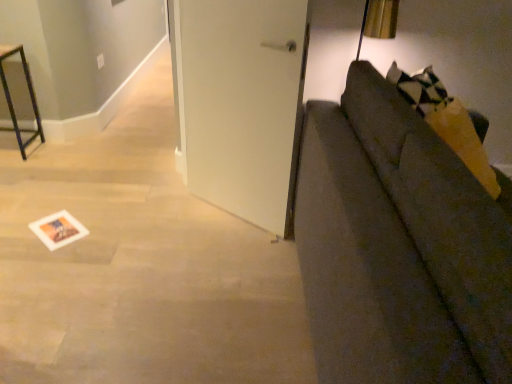
Image resolution: width=512 pixels, height=384 pixels. In order to click on white matte door at center in this screenshot , I will do coord(241,104).

The width and height of the screenshot is (512, 384). I want to click on metal frame at left, so click(x=12, y=102).

From a real-world perspective, who is located higher, white paper postcard at lower left or textured gray couch at right?

textured gray couch at right.

Consider the image. Between white paper postcard at lower left and textured gray couch at right, which one appears on the left side from the viewer's perspective?

white paper postcard at lower left is more to the left.

Choose the correct answer: Is white paper postcard at lower left inside textured gray couch at right or outside it?

The correct answer is: outside.

From a real-world perspective, which is physically above, white paper postcard at lower left or metal frame at left?

metal frame at left is physically above.

From the image's perspective, between white paper postcard at lower left and metal frame at left, who is located below?

From the image's view, white paper postcard at lower left is below.

Which object is further away from the camera taking this photo, white paper postcard at lower left or metal frame at left?

Positioned behind is metal frame at left.

Is white paper postcard at lower left facing away from metal frame at left?

No.

From their relative heights in the image, would you say metal frame at left is taller or shorter than white paper postcard at lower left?

metal frame at left is taller than white paper postcard at lower left.

Between point (6, 101) and point (71, 228), which one is positioned behind?

The point (6, 101) is farther.

Based on the photo, from the image's perspective, which is below, metal frame at left or white paper postcard at lower left?

white paper postcard at lower left.

Which of these two, metal frame at left or white paper postcard at lower left, is wider?

metal frame at left.

From a real-world perspective, who is located higher, white matte door at center or textured gray couch at right?

white matte door at center.

Which is more to the left, white matte door at center or textured gray couch at right?

From the viewer's perspective, white matte door at center appears more on the left side.

From the image's perspective, is white matte door at center positioned above or below textured gray couch at right?

white matte door at center is situated higher than textured gray couch at right in the image.

Which object is positioned more to the right, textured gray couch at right or white matte door at center?

textured gray couch at right is more to the right.

How many degrees apart are the facing directions of textured gray couch at right and white matte door at center?

The facing directions of textured gray couch at right and white matte door at center are 130 degrees apart.

The width and height of the screenshot is (512, 384). What are the coordinates of `door behind the textured gray couch at right` in the screenshot? It's located at [241, 104].

From the picture: From the image's perspective, between white matte door at center and white paper postcard at lower left, which one is located above?

white matte door at center appears higher in the image.

Which is more to the right, white matte door at center or white paper postcard at lower left?

white matte door at center is more to the right.

Is white matte door at center far away from white paper postcard at lower left?

Indeed, white matte door at center is not near white paper postcard at lower left.

Identify the location of door above the white paper postcard at lower left (from the image's perspective). (241, 104).

From a real-world perspective, which is physically below, white matte door at center or metal frame at left?

From a 3D spatial view, metal frame at left is below.

Is white matte door at center far away from metal frame at left?

Yes, white matte door at center and metal frame at left are quite far apart.

Looking at their sizes, would you say white matte door at center is wider or thinner than metal frame at left?

In the image, white matte door at center appears to be more narrow than metal frame at left.

Which is further, [261,157] or [7,52]?

The point [7,52] is farther from the camera.

Identify the location of postcard behind the textured gray couch at right. This screenshot has width=512, height=384. (58, 230).

Identify the location of furniture above the white paper postcard at lower left (from the image's perspective). The width and height of the screenshot is (512, 384). tap(12, 102).

From the image, which object appears to be nearer to white matte door at center, textured gray couch at right or metal frame at left?

Based on the image, textured gray couch at right appears to be nearer to white matte door at center.

Consider the image. Considering their positions, is white matte door at center positioned further to white paper postcard at lower left than textured gray couch at right?

textured gray couch at right.

From the picture: Based on their spatial positions, is metal frame at left or white matte door at center closer to white paper postcard at lower left?

white matte door at center.

Considering their positions, is textured gray couch at right positioned further to metal frame at left than white matte door at center?

textured gray couch at right.

Looking at the image, which one is located further to white matte door at center, white paper postcard at lower left or textured gray couch at right?

Among the two, white paper postcard at lower left is located further to white matte door at center.

Which object lies further to the anchor point white matte door at center, metal frame at left or textured gray couch at right?

metal frame at left is positioned further to the anchor white matte door at center.

From the image, which object appears to be nearer to metal frame at left, white paper postcard at lower left or textured gray couch at right?

white paper postcard at lower left is closer to metal frame at left.

Considering their positions, is white paper postcard at lower left positioned further to white matte door at center than metal frame at left?

metal frame at left is further to white matte door at center.

Identify the location of door between metal frame at left and textured gray couch at right. Image resolution: width=512 pixels, height=384 pixels. (241, 104).

Image resolution: width=512 pixels, height=384 pixels. I want to click on postcard situated between metal frame at left and textured gray couch at right from left to right, so click(x=58, y=230).

Find the location of `door situated between white paper postcard at lower left and textured gray couch at right from left to right`. door situated between white paper postcard at lower left and textured gray couch at right from left to right is located at coordinates (241, 104).

At what (x,y) coordinates should I click in order to perform the action: click on postcard between metal frame at left and white matte door at center. Please return your answer as a coordinate pair (x, y). This screenshot has width=512, height=384. Looking at the image, I should click on (58, 230).